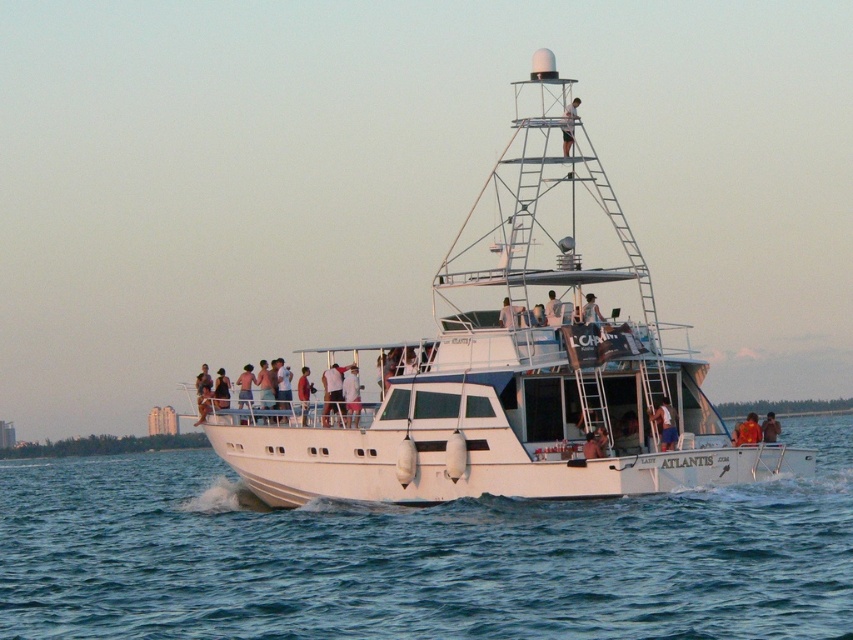
You are a photographer on the boat Atlantis, and you need to capture a photo of the brown leather jacket at center and the white fabric shirt at center. Which one is positioned lower in the image?

→ The brown leather jacket at center is below the white fabric shirt at center, so the brown leather jacket at center is positioned lower in the image.

You are a photographer on the motorboat Atlantis. You want to take a photo of two specific points marked on the boat. The first point is at coordinates point (747, 433) and the second is at point (308, 404). Which point will appear larger in your photo?

Point (747, 433) is closer to the camera than point (308, 404), so it will appear larger in the photo.

You are a photographer on the upper deck of the Atlantis motorboat. You notice two people wearing an orange fabric shirt at center and a red fabric shirt at center. Which shirt is positioned to the right when looking towards the center of the boat?

The orange fabric shirt at center is positioned to the right of the red fabric shirt at center when looking towards the center of the boat.